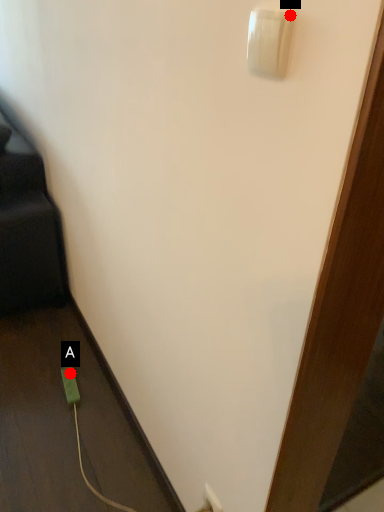
Question: Two points are circled on the image, labeled by A and B beside each circle. Among these points, which one is farthest from the camera?

Choices:
 (A) A is further
 (B) B is further

Answer: (A)